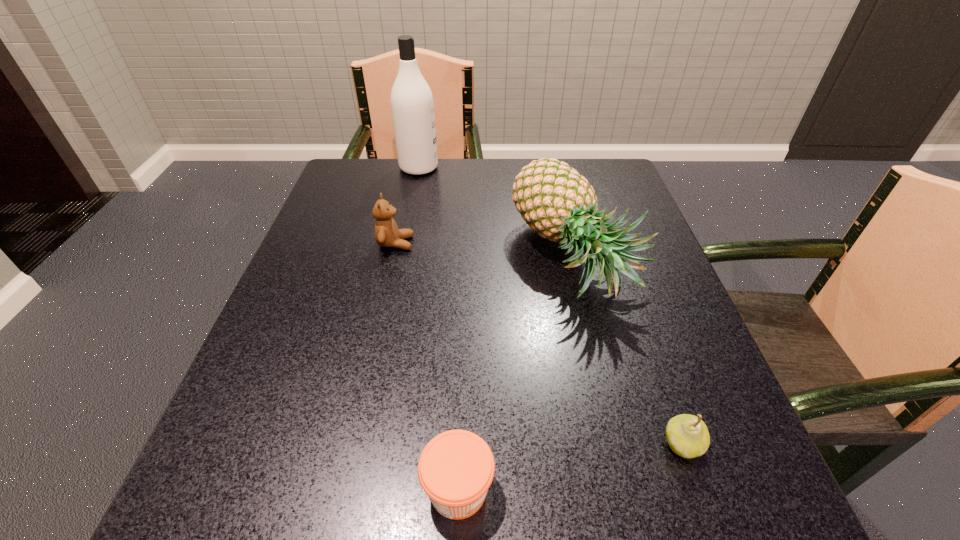
The height and width of the screenshot is (540, 960). I want to click on blank area located 0.170m on the back of the second shortest object, so click(x=644, y=335).

Identify the location of free location located on the front label of the shortest object. (600, 489).

This screenshot has height=540, width=960. I want to click on object present at the far edge, so click(412, 105).

Locate an element on the screen. The width and height of the screenshot is (960, 540). object that is at the near edge is located at coordinates (456, 468).

Locate an element on the screen. The image size is (960, 540). shampoo present at the left edge is located at coordinates (412, 105).

You are a GUI agent. You are given a task and a screenshot of the screen. Output one action in this format:
    pyautogui.click(x=<x>, y=<y>)
    Task: Click on the teddy bear present at the left edge
    This screenshot has height=540, width=960.
    Given the screenshot: What is the action you would take?
    pyautogui.click(x=387, y=234)

Image resolution: width=960 pixels, height=540 pixels. Identify the location of pineapple that is at the right edge. (557, 202).

The width and height of the screenshot is (960, 540). In order to click on pear that is at the right edge in this screenshot , I will do `click(687, 435)`.

Locate an element on the screen. This screenshot has width=960, height=540. object located at the far left corner is located at coordinates (412, 105).

You are a GUI agent. You are given a task and a screenshot of the screen. Output one action in this format:
    pyautogui.click(x=<x>, y=<y>)
    Task: Click on the blank space at the far edge of the desktop
    The width and height of the screenshot is (960, 540).
    Given the screenshot: What is the action you would take?
    pyautogui.click(x=438, y=203)